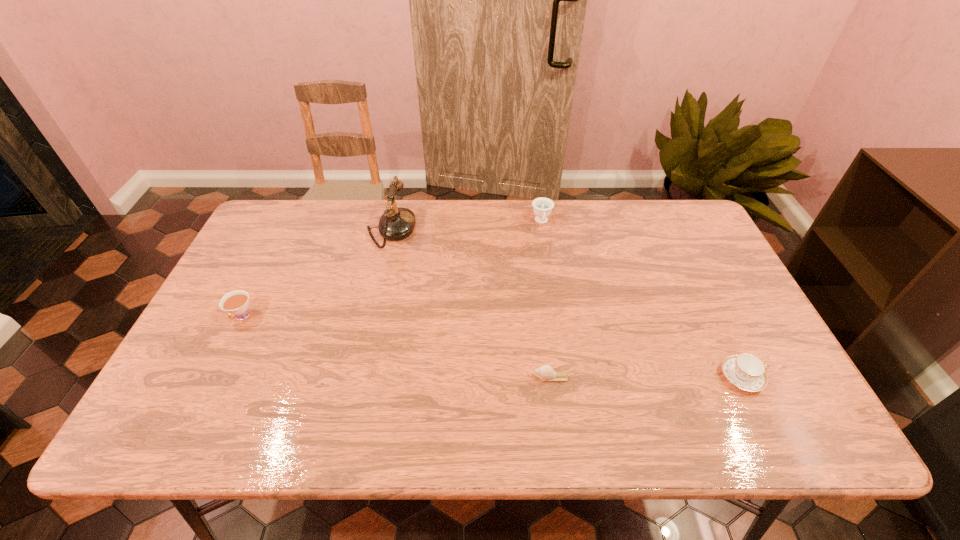
What are the coordinates of `vacant area that lies between the second teacup from left to right and the leftmost teacup` in the screenshot? It's located at (392, 269).

Identify the location of free area in between the shortest teacup and the leftmost teacup. This screenshot has width=960, height=540. (492, 347).

In order to click on free space between the telephone and the rightmost object in this screenshot , I will do pos(566,303).

You are a GUI agent. You are given a task and a screenshot of the screen. Output one action in this format:
    pyautogui.click(x=<x>, y=<y>)
    Task: Click on the vacant area between the leftmost teacup and the farthest teacup
    This screenshot has width=960, height=540.
    Given the screenshot: What is the action you would take?
    pyautogui.click(x=392, y=269)

Locate an element on the screen. The image size is (960, 540). empty location between the escargot and the second object from left to right is located at coordinates (471, 303).

Identify the location of vacant area between the fourth tallest object and the telephone. (566, 303).

Find the location of a particular element. object that stands as the fourth closest to the tallest object is located at coordinates (745, 371).

Identify which object is the second closest to the shortest object. Please provide its 2D coordinates. Your answer should be formatted as a tuple, i.e. [(x, y)], where the tuple contains the x and y coordinates of a point satisfying the conditions above.

[(542, 207)]

Identify which teacup is the second closest to the leftmost teacup. Please provide its 2D coordinates. Your answer should be formatted as a tuple, i.e. [(x, y)], where the tuple contains the x and y coordinates of a point satisfying the conditions above.

[(745, 371)]

Find the location of a particular element. Image resolution: width=960 pixels, height=540 pixels. teacup that is the third closest one to the telephone is located at coordinates (745, 371).